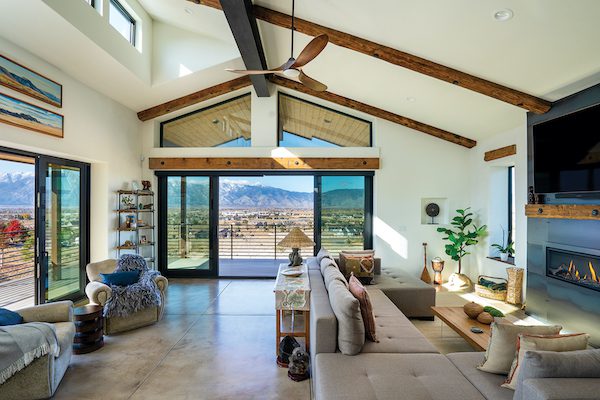
Locate an element on the screen. floor area is located at coordinates 209,356.